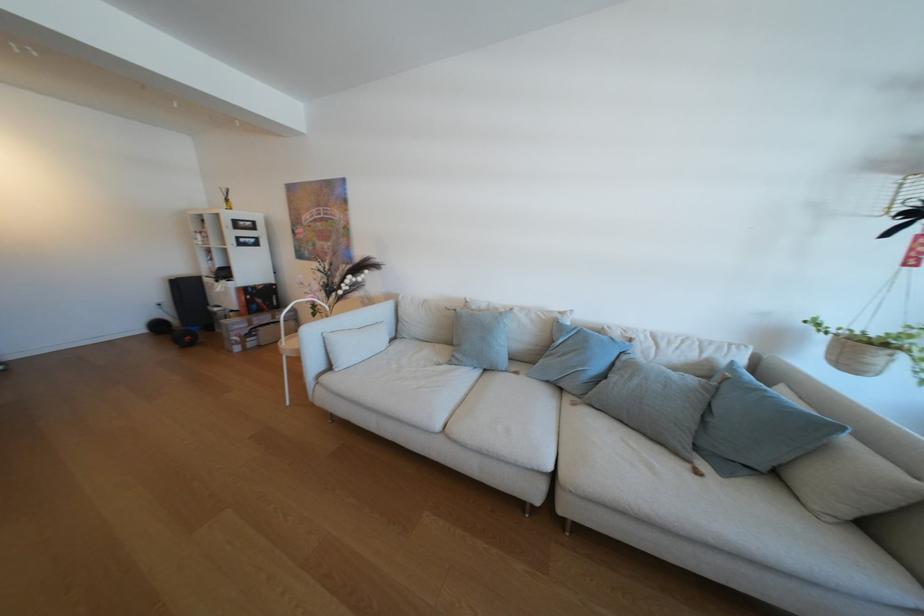
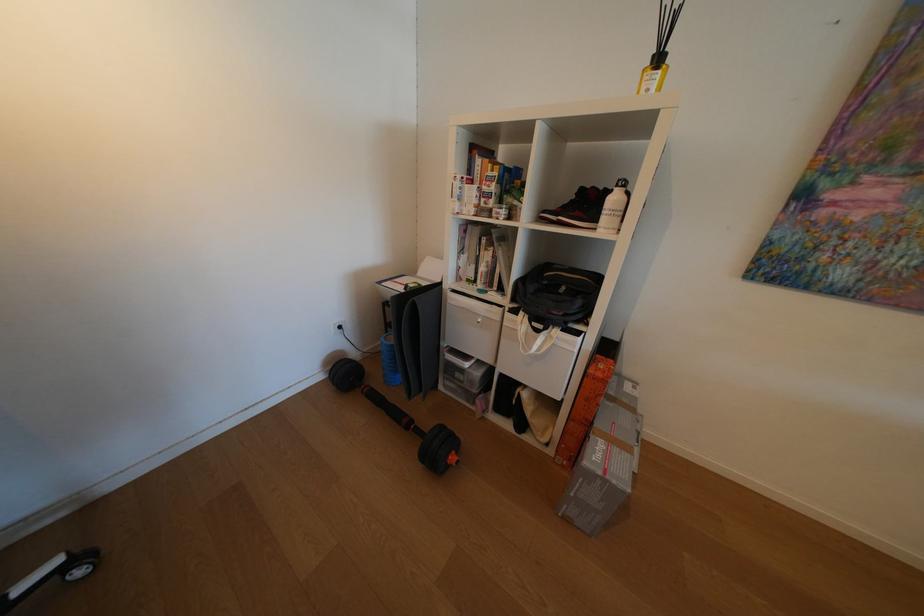
Find the pixel in the second image that matches (227,283) in the first image.

(548, 331)